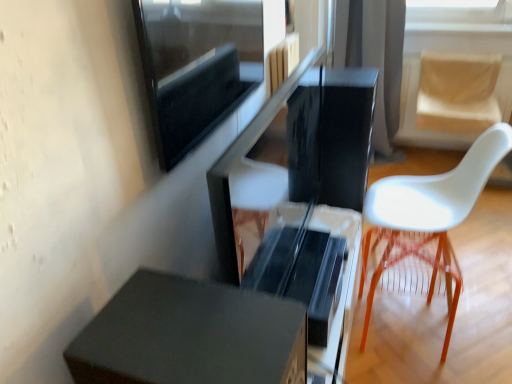
Image resolution: width=512 pixels, height=384 pixels. What are the coordinates of `blank space situated above matte black drawer at lower left (from a real-world perspective)` in the screenshot? It's located at (175, 330).